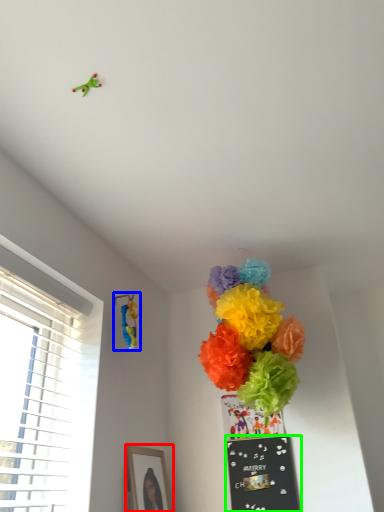
Question: Estimate the real-world distances between objects in this image. Which object is farther from picture frame (highlighted by a red box), toy (highlighted by a blue box) or bulletin board (highlighted by a green box)?

Choices:
 (A) toy
 (B) bulletin board

Answer: (A)